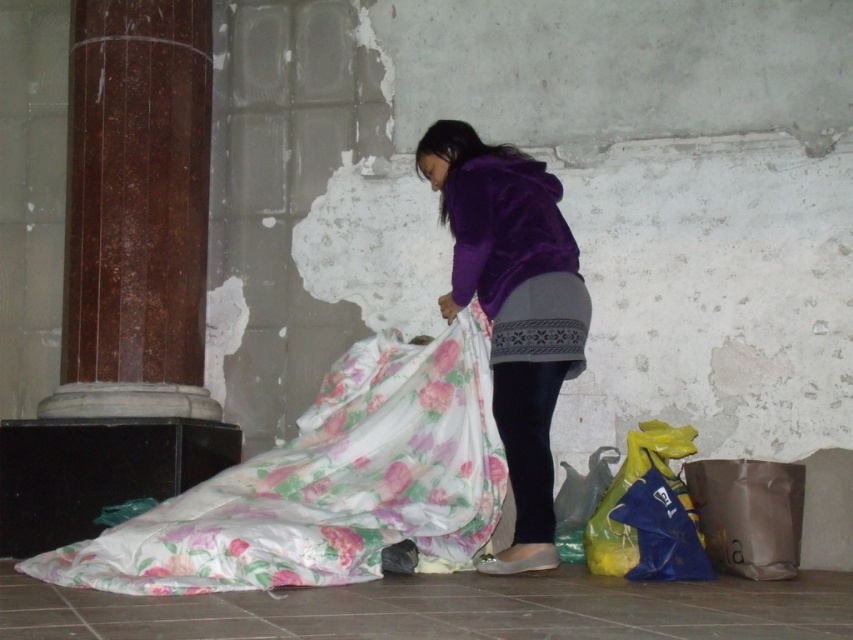
Is point (276, 461) closer to viewer compared to point (180, 54)?

Yes, it is in front of point (180, 54).

Between floral satin blanket at lower left and maroon polished column at left, which one is positioned higher?

maroon polished column at left

Find the location of a particular element. floral satin blanket at lower left is located at coordinates (328, 484).

Where is `floral satin blanket at lower left`? The height and width of the screenshot is (640, 853). floral satin blanket at lower left is located at coordinates (328, 484).

Is maroon polished column at left above yellow plastic bag at lower right?

Indeed, maroon polished column at left is positioned over yellow plastic bag at lower right.

Which of these two, maroon polished column at left or yellow plastic bag at lower right, stands taller?

maroon polished column at left is taller.

Describe the element at coordinates (136, 211) in the screenshot. This screenshot has height=640, width=853. I see `maroon polished column at left` at that location.

In order to click on maroon polished column at left in this screenshot , I will do `click(136, 211)`.

Who is positioned more to the left, matte brown paper bag at lower right or matte green plastic bag at lower right?

matte green plastic bag at lower right

The height and width of the screenshot is (640, 853). Identify the location of matte brown paper bag at lower right. (747, 515).

You are a GUI agent. You are given a task and a screenshot of the screen. Output one action in this format:
    pyautogui.click(x=<x>, y=<y>)
    Task: Click on the matte brown paper bag at lower right
    The image size is (853, 640).
    Given the screenshot: What is the action you would take?
    pyautogui.click(x=747, y=515)